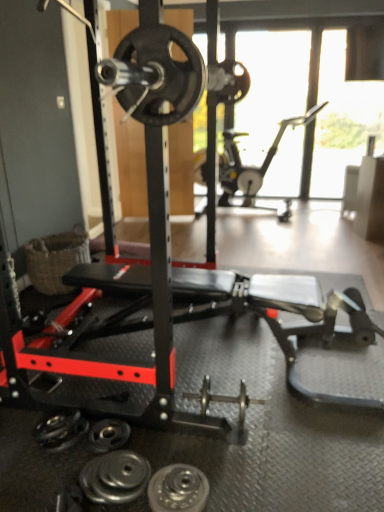
What do you see at coordinates (178, 489) in the screenshot?
I see `silver metallic weight plate at lower center, which appears as the 2th wheel when viewed from the left` at bounding box center [178, 489].

In order to face woven brown basket at lower left, should I rotate leftwards or rightwards?

It's best to rotate left around 17.478 degrees.

Locate an element on the screen. This screenshot has width=384, height=512. metallic silver exercise bike at upper right is located at coordinates (251, 166).

Locate an element on the screen. Image resolution: width=384 pixels, height=512 pixels. polished silver dumbbell at center, the 2th dumbbell when ordered from left to right is located at coordinates (223, 399).

What do you see at coordinates (223, 399) in the screenshot? This screenshot has width=384, height=512. I see `polished silver dumbbell at center, the first dumbbell viewed from the right` at bounding box center [223, 399].

Identify the location of polished silver dumbbell at lower left, acting as the 1th dumbbell starting from the front. This screenshot has height=512, width=384. (115, 477).

From the image's perspective, which one is positioned lower, black rubber weight plate at lower center, the 1th wheel from the left, or polished silver dumbbell at center, the first dumbbell viewed from the right?

black rubber weight plate at lower center, the 1th wheel from the left, appears lower in the image.

Based on the photo, which is closer, (108, 436) or (209, 392)?

Point (108, 436) appears to be closer to the viewer than point (209, 392).

Is black rubber weight plate at lower center, the second wheel when ordered from right to left, beside polished silver dumbbell at center, the 1th dumbbell viewed from the top?

black rubber weight plate at lower center, the second wheel when ordered from right to left, and polished silver dumbbell at center, the 1th dumbbell viewed from the top, are clearly separated.

Which object is positioned more to the left, woven brown basket at lower left or silver metallic weight plate at lower center, the 2th wheel positioned from the back?

woven brown basket at lower left is more to the left.

Considering the relative positions of woven brown basket at lower left and silver metallic weight plate at lower center, which appears as the first wheel when viewed from the front, in the image provided, is woven brown basket at lower left in front of silver metallic weight plate at lower center, which appears as the first wheel when viewed from the front,?

No, woven brown basket at lower left is further to the viewer.

Is woven brown basket at lower left shorter than silver metallic weight plate at lower center, which appears as the 2th wheel when viewed from the left?

In fact, woven brown basket at lower left may be taller than silver metallic weight plate at lower center, which appears as the 2th wheel when viewed from the left.

Does point (237, 398) lie behind point (124, 482)?

Yes, it is behind point (124, 482).

How different are the orientations of polished silver dumbbell at center, which appears as the 2th dumbbell when ordered from the bottom, and polished silver dumbbell at lower left, the first dumbbell viewed from the left, in degrees?

They differ by 97.5 degrees in their facing directions.

From a real-world perspective, is polished silver dumbbell at center, which appears as the 2th dumbbell when ordered from the bottom, above or below polished silver dumbbell at lower left, the first dumbbell viewed from the left?

polished silver dumbbell at center, which appears as the 2th dumbbell when ordered from the bottom, is above polished silver dumbbell at lower left, the first dumbbell viewed from the left.

Would you say polished silver dumbbell at center, the first dumbbell viewed from the right, is to the left or to the right of polished silver dumbbell at lower left, positioned as the 2th dumbbell in right-to-left order, in the picture?

polished silver dumbbell at center, the first dumbbell viewed from the right, is to the right of polished silver dumbbell at lower left, positioned as the 2th dumbbell in right-to-left order.

From a real-world perspective, which is physically above, metallic silver exercise bike at upper right or black rubberized training bench at center?

metallic silver exercise bike at upper right is physically above.

Does metallic silver exercise bike at upper right appear on the left side of black rubberized training bench at center?

In fact, metallic silver exercise bike at upper right is to the right of black rubberized training bench at center.

Consider the image. Can you tell me how much metallic silver exercise bike at upper right and black rubberized training bench at center differ in facing direction?

90.5 degrees.

From the image's perspective, which is above, metallic silver exercise bike at upper right or black rubberized training bench at center?

metallic silver exercise bike at upper right is shown above in the image.

Which of these two, polished silver dumbbell at center, acting as the second dumbbell starting from the front, or black rubber weight plate at lower center, the 2th wheel when ordered from front to back, is smaller?

With smaller size is black rubber weight plate at lower center, the 2th wheel when ordered from front to back.

Is the depth of polished silver dumbbell at center, the 1th dumbbell viewed from the top, less than that of black rubber weight plate at lower center, the 2th wheel when ordered from front to back?

That is False.

Considering the relative sizes of polished silver dumbbell at center, the 1th dumbbell viewed from the top, and black rubber weight plate at lower center, the 1th wheel from the left, in the image provided, is polished silver dumbbell at center, the 1th dumbbell viewed from the top, taller than black rubber weight plate at lower center, the 1th wheel from the left,?

Correct, polished silver dumbbell at center, the 1th dumbbell viewed from the top, is much taller as black rubber weight plate at lower center, the 1th wheel from the left.

Which is behind, point (243, 411) or point (112, 421)?

Point (243, 411)

Considering the sizes of objects silver metallic weight plate at lower center, the 2th wheel positioned from the back, and polished silver dumbbell at lower left, acting as the 1th dumbbell starting from the front, in the image provided, who is bigger, silver metallic weight plate at lower center, the 2th wheel positioned from the back, or polished silver dumbbell at lower left, acting as the 1th dumbbell starting from the front,?

polished silver dumbbell at lower left, acting as the 1th dumbbell starting from the front, is bigger.

Is silver metallic weight plate at lower center, which appears as the 2th wheel when viewed from the left, facing away from polished silver dumbbell at lower left, positioned as the 2th dumbbell in right-to-left order?

Yes.

Which object is wider, silver metallic weight plate at lower center, which appears as the first wheel when viewed from the front, or polished silver dumbbell at lower left, the 2th dumbbell from the back?

With larger width is silver metallic weight plate at lower center, which appears as the first wheel when viewed from the front.

Between point (182, 501) and point (87, 465), which one is positioned in front?

The point (182, 501) is closer.

Identify the location of wheel that is the 2nd one when counting downward from the polished silver dumbbell at center, the first dumbbell from the back (from the image's perspective). The width and height of the screenshot is (384, 512). (178, 489).

Is polished silver dumbbell at center, acting as the second dumbbell starting from the front, bigger than silver metallic weight plate at lower center, the 1th wheel in the right-to-left sequence?

Indeed, polished silver dumbbell at center, acting as the second dumbbell starting from the front, has a larger size compared to silver metallic weight plate at lower center, the 1th wheel in the right-to-left sequence.

Could silver metallic weight plate at lower center, which appears as the first wheel when viewed from the front, be considered to be inside polished silver dumbbell at center, the 2th dumbbell when ordered from left to right?

No, silver metallic weight plate at lower center, which appears as the first wheel when viewed from the front, is not a part of polished silver dumbbell at center, the 2th dumbbell when ordered from left to right.

Starting from the black rubber weight plate at lower center, the second wheel when ordered from right to left, which dumbbell is the 2nd one to the right? Please provide its 2D coordinates.

[(223, 399)]

Identify the location of basket above the silver metallic weight plate at lower center, which appears as the first wheel when viewed from the front (from a real-world perspective). Image resolution: width=384 pixels, height=512 pixels. tap(55, 260).

Looking at the image, which one is located further to black rubberized training bench at center, polished silver dumbbell at lower left, the first dumbbell viewed from the left, or black rubber weight plate at lower center, the 2th wheel when ordered from front to back?

polished silver dumbbell at lower left, the first dumbbell viewed from the left.

Which object lies nearer to the anchor point polished silver dumbbell at center, the first dumbbell from the back, polished silver dumbbell at lower left, the first dumbbell viewed from the left, or black rubberized training bench at center?

polished silver dumbbell at lower left, the first dumbbell viewed from the left, lies closer to polished silver dumbbell at center, the first dumbbell from the back, than the other object.

Looking at the image, which one is located further to metallic silver exercise bike at upper right, polished silver dumbbell at lower left, arranged as the 2th dumbbell when viewed from the top, or woven brown basket at lower left?

polished silver dumbbell at lower left, arranged as the 2th dumbbell when viewed from the top, lies further to metallic silver exercise bike at upper right than the other object.

From the image, which object appears to be nearer to polished silver dumbbell at lower left, acting as the 1th dumbbell starting from the front, polished silver dumbbell at center, the 2th dumbbell when ordered from left to right, or black rubberized training bench at center?

Among the two, polished silver dumbbell at center, the 2th dumbbell when ordered from left to right, is located nearer to polished silver dumbbell at lower left, acting as the 1th dumbbell starting from the front.

When comparing their distances from metallic silver exercise bike at upper right, does woven brown basket at lower left or black rubberized training bench at center seem further?

black rubberized training bench at center.

When comparing their distances from silver metallic weight plate at lower center, which appears as the first wheel when viewed from the front, does black rubberized training bench at center or polished silver dumbbell at center, the first dumbbell viewed from the right, seem closer?

Among the two, polished silver dumbbell at center, the first dumbbell viewed from the right, is located nearer to silver metallic weight plate at lower center, which appears as the first wheel when viewed from the front.

Which object lies further to the anchor point black rubber weight plate at lower center, the 1th wheel from the left, woven brown basket at lower left or polished silver dumbbell at center, the first dumbbell viewed from the right?

Among the two, woven brown basket at lower left is located further to black rubber weight plate at lower center, the 1th wheel from the left.

Based on their spatial positions, is black rubber weight plate at lower center, the 1th wheel from the left, or polished silver dumbbell at center, the 2th dumbbell when ordered from left to right, closer to woven brown basket at lower left?

Among the two, polished silver dumbbell at center, the 2th dumbbell when ordered from left to right, is located nearer to woven brown basket at lower left.

Where is `dumbbell between black rubberized training bench at center and black rubber weight plate at lower center, the 1th wheel from the left, vertically`? This screenshot has height=512, width=384. dumbbell between black rubberized training bench at center and black rubber weight plate at lower center, the 1th wheel from the left, vertically is located at coordinates (223, 399).

Locate an element on the screen. This screenshot has width=384, height=512. wheel positioned between polished silver dumbbell at lower left, positioned as the 2th dumbbell in right-to-left order, and metallic silver exercise bike at upper right from near to far is located at coordinates (108, 435).

Locate an element on the screen. Image resolution: width=384 pixels, height=512 pixels. dumbbell between black rubberized training bench at center and polished silver dumbbell at lower left, acting as the 1th dumbbell starting from the front, in the vertical direction is located at coordinates (223, 399).

The image size is (384, 512). I want to click on dumbbell positioned between polished silver dumbbell at lower left, positioned as the 2th dumbbell in right-to-left order, and metallic silver exercise bike at upper right from near to far, so 223,399.